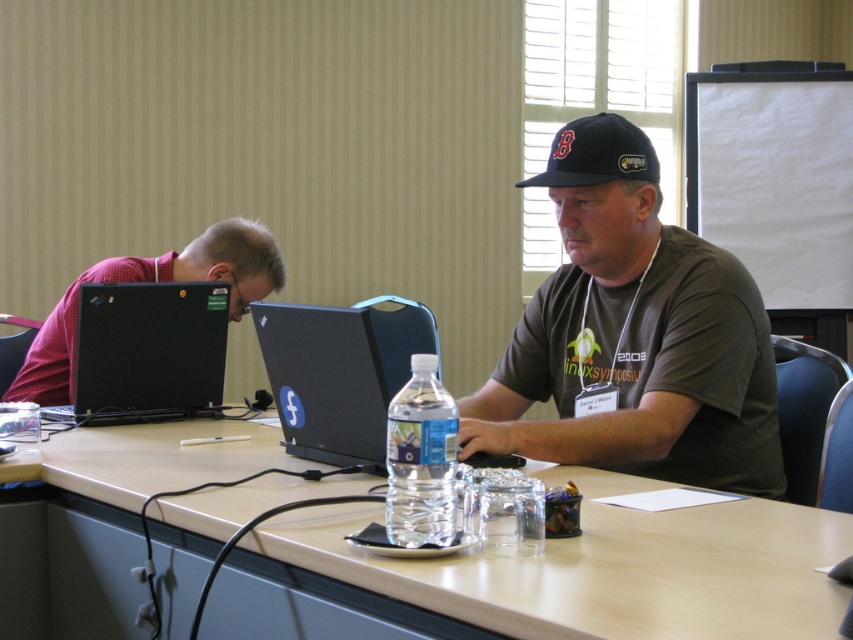
Question: Which point appears farthest from the camera in this image?

Choices:
 (A) (392, 486)
 (B) (286, 320)
 (C) (166, 291)

Answer: (C)

Question: Is dark gray t-shirt at center closer to the viewer compared to black matte laptop at left?

Choices:
 (A) yes
 (B) no

Answer: (A)

Question: Among these objects, which one is farthest from the camera?

Choices:
 (A) dark gray t-shirt at center
 (B) smooth wooden table at center
 (C) clear plastic bottle at center
 (D) navy blue fabric baseball cap at upper center

Answer: (D)

Question: Is dark gray t-shirt at center thinner than navy blue fabric baseball cap at upper center?

Choices:
 (A) yes
 (B) no

Answer: (B)

Question: Among these objects, which one is farthest from the camera?

Choices:
 (A) black plastic laptop at center
 (B) black matte laptop at left

Answer: (A)

Question: Can you confirm if clear plastic bottle at center is positioned to the right of navy blue fabric baseball cap at upper center?

Choices:
 (A) no
 (B) yes

Answer: (A)